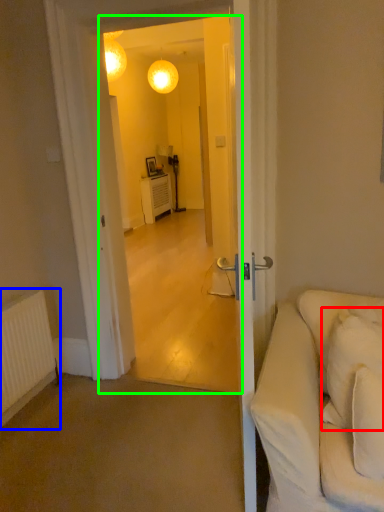
Question: Based on their relative distances, which object is nearer to pillow (highlighted by a red box)? Choose from radiator (highlighted by a blue box) and screen door (highlighted by a green box).

Choices:
 (A) radiator
 (B) screen door

Answer: (A)